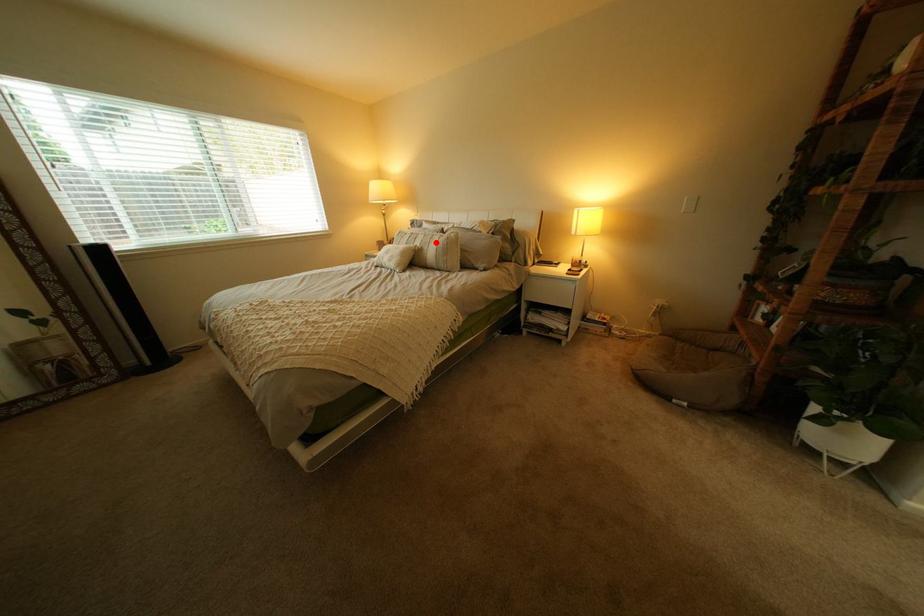
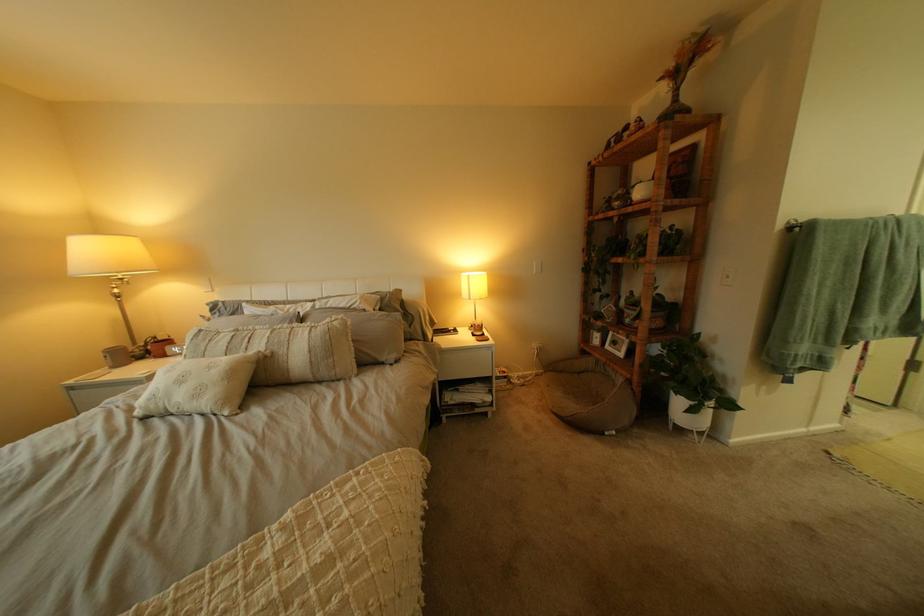
Question: I am providing you with two images of the same scene from different viewpoints. Given a red point in image1, look at the same physical point in image2. Is it:

Choices:
 (A) Closer to the viewpoint
 (B) Farther from the viewpoint

Answer: (B)